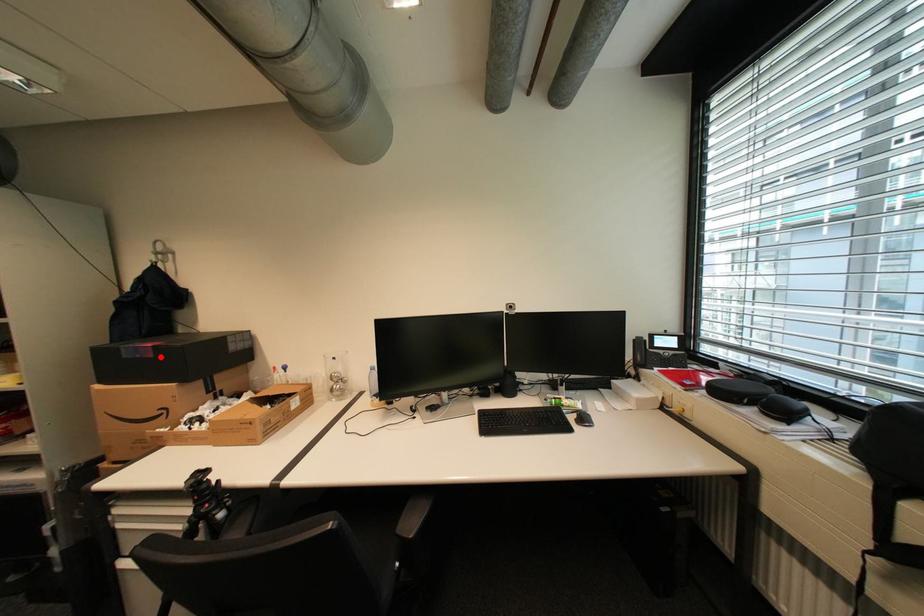
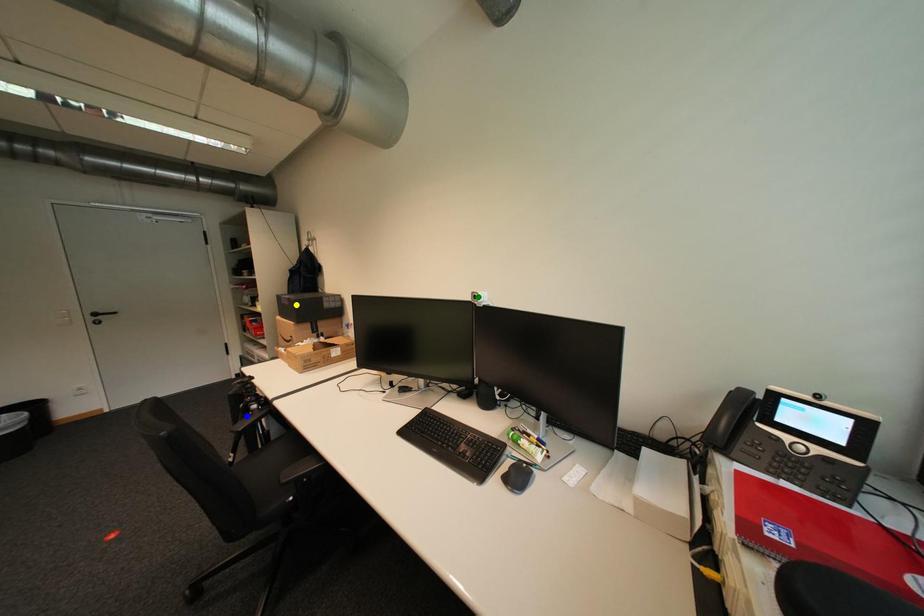
Question: I am providing you with two images of the same scene from different viewpoints. A red point is marked on the first image. You are given multiple points on the second image. Which spot in image 2 lines up with the point in image 1?

Choices:
 (A) yellow point
 (B) green point
 (C) blue point

Answer: (A)